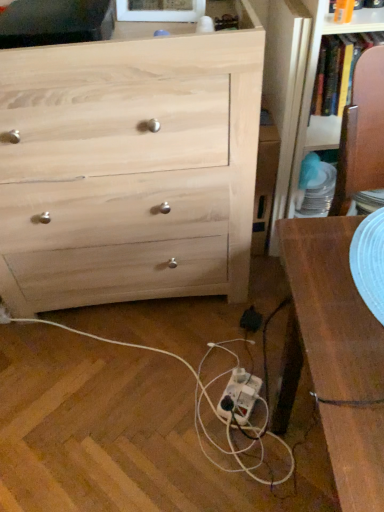
Find the location of a particular element. blank space situated above white plastic power strip at lower center (from a real-world perspective) is located at coordinates (147, 375).